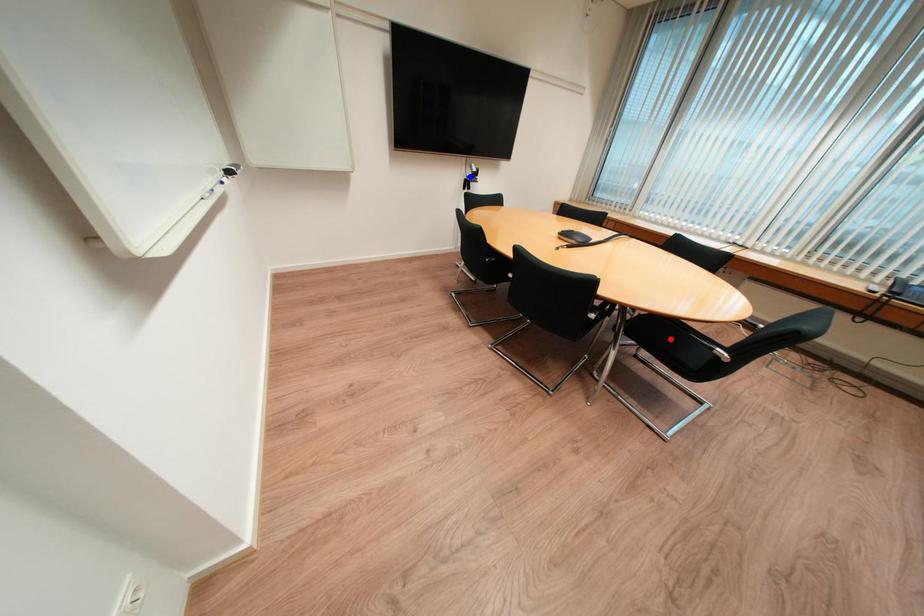
Question: Which of the two points in the image is closer to the camera?

Choices:
 (A) Blue point is closer.
 (B) Red point is closer.

Answer: (B)